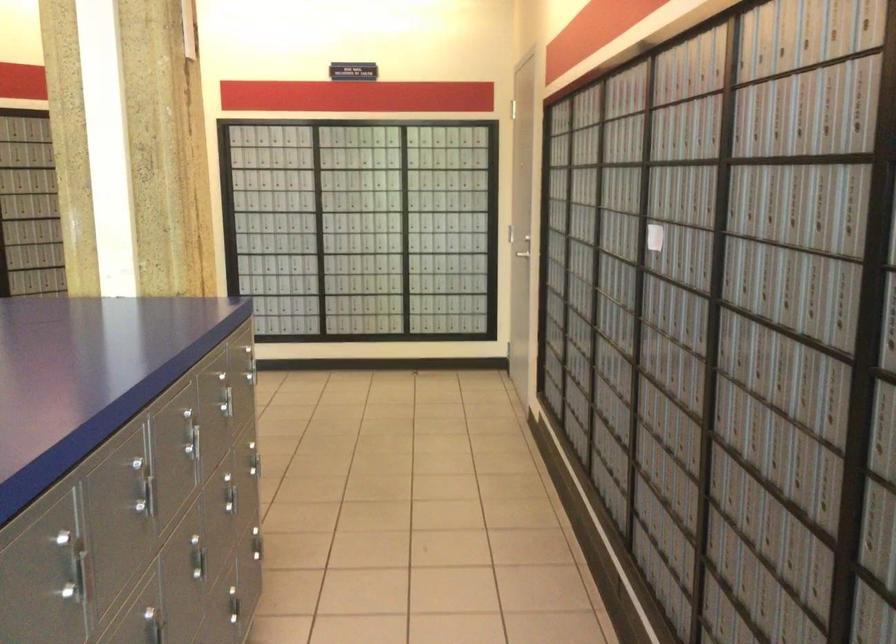
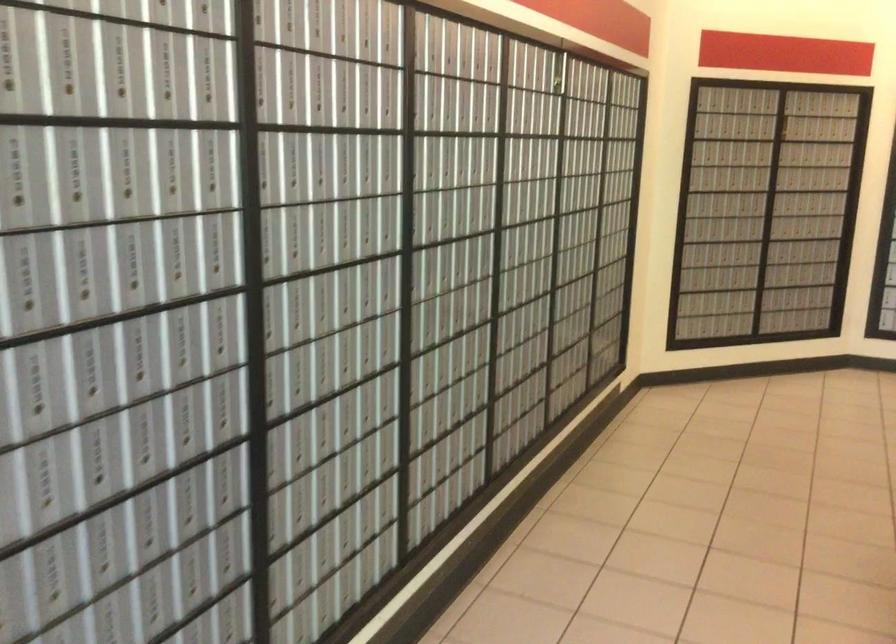
Question: What movement of the cameraman would produce the second image?

Choices:
 (A) Left
 (B) Right
 (C) Forward
 (D) Backward

Answer: (A)